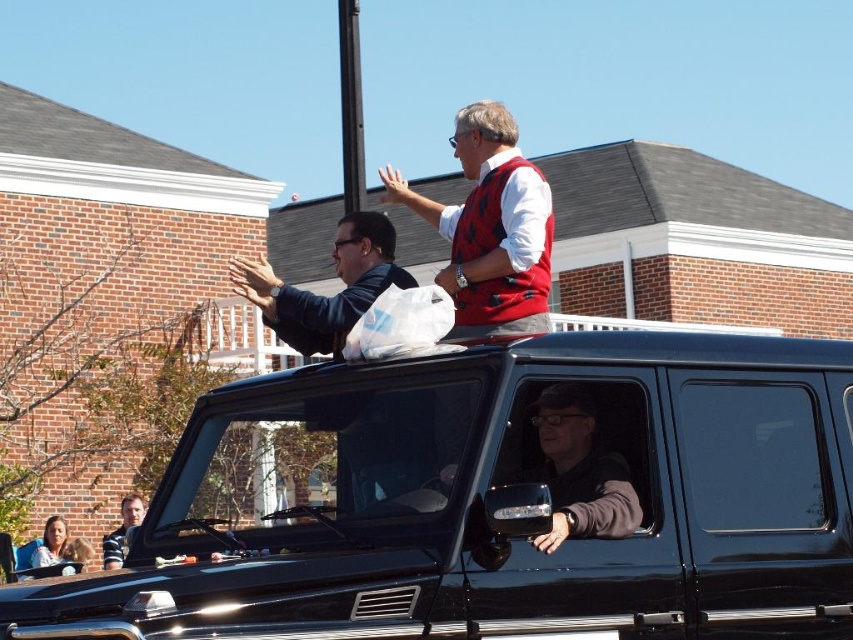
Question: Is black matte jeep at center above matte black jacket at center?

Choices:
 (A) yes
 (B) no

Answer: (B)

Question: Which object appears farthest from the camera in this image?

Choices:
 (A) matte red vest at upper center
 (B) matte black jacket at upper left

Answer: (B)

Question: In this image, where is matte black jacket at center located relative to matte black jacket at upper left?

Choices:
 (A) right
 (B) left

Answer: (A)

Question: Can you confirm if black matte jeep at center is positioned below matte black jacket at upper left?

Choices:
 (A) no
 (B) yes

Answer: (B)

Question: Estimate the real-world distances between objects in this image. Which object is farther from the matte black jacket at upper left?

Choices:
 (A) matte red vest at upper center
 (B) black matte jeep at center
 (C) matte black jacket at center

Answer: (B)

Question: Which object is the closest to the black matte jeep at center?

Choices:
 (A) matte black jacket at center
 (B) matte black jacket at upper left

Answer: (A)